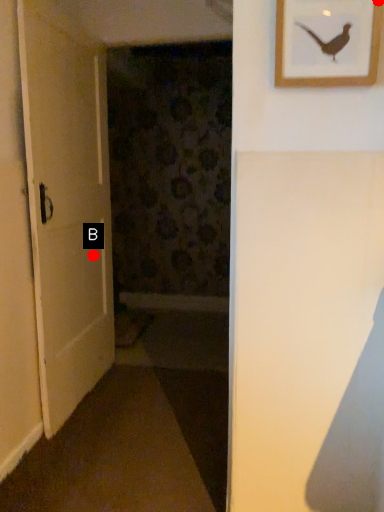
Question: Two points are circled on the image, labeled by A and B beside each circle. Which point is closer to the camera?

Choices:
 (A) A is closer
 (B) B is closer

Answer: (A)